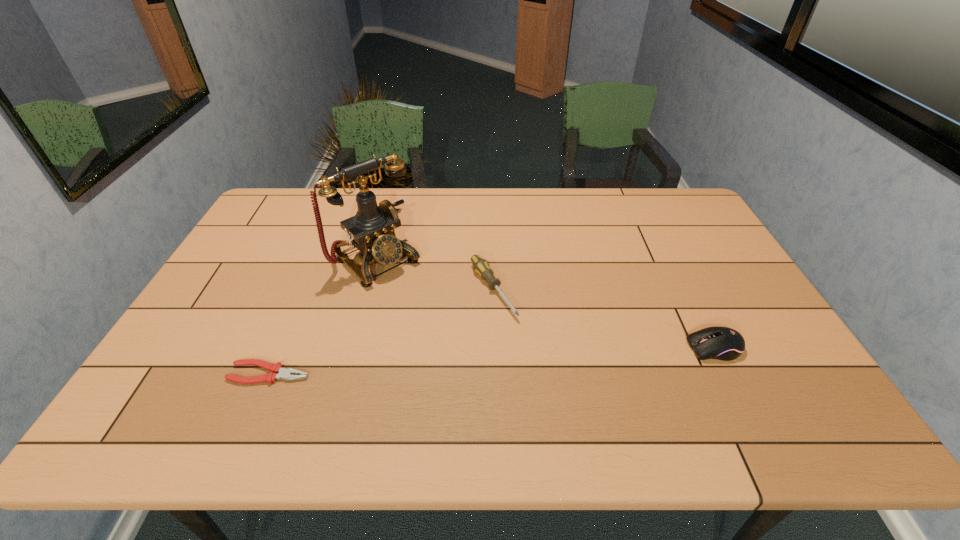
Where is `free space on the desktop that is between the shortest object and the computer mouse and is positioned on the front of the tallest object, featuring the rotary dial`? free space on the desktop that is between the shortest object and the computer mouse and is positioned on the front of the tallest object, featuring the rotary dial is located at coordinates (486, 361).

I want to click on vacant space on the desktop that is between the shortest object and the computer mouse and is positioned at the tip of the second shortest object, so click(x=543, y=357).